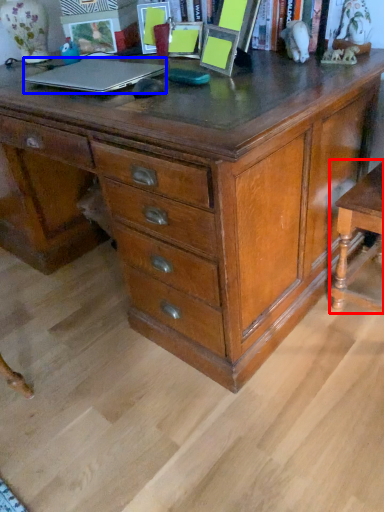
Question: Which of the following is the farthest to the observer, table (highlighted by a red box) or laptop (highlighted by a blue box)?

Choices:
 (A) table
 (B) laptop

Answer: (B)